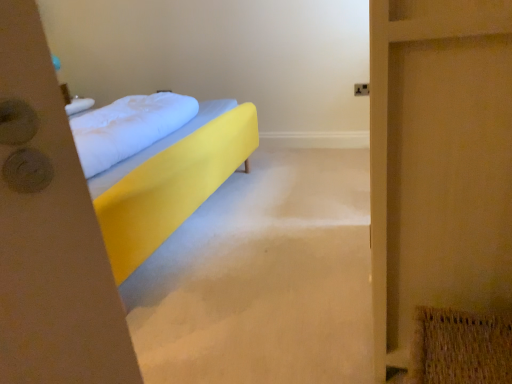
Question: Is wooden screen door at right spatially inside white soft pillow at center, or outside of it?

Choices:
 (A) inside
 (B) outside

Answer: (B)

Question: Based on their positions, is wooden screen door at right located to the left or right of white soft pillow at center?

Choices:
 (A) right
 (B) left

Answer: (A)

Question: Considering the real-world distances, which object is farthest from the white soft pillow at center?

Choices:
 (A) wooden screen door at right
 (B) yellow fabric bed at center

Answer: (A)

Question: Which object is the closest to the white soft pillow at center?

Choices:
 (A) wooden screen door at right
 (B) yellow fabric bed at center

Answer: (B)